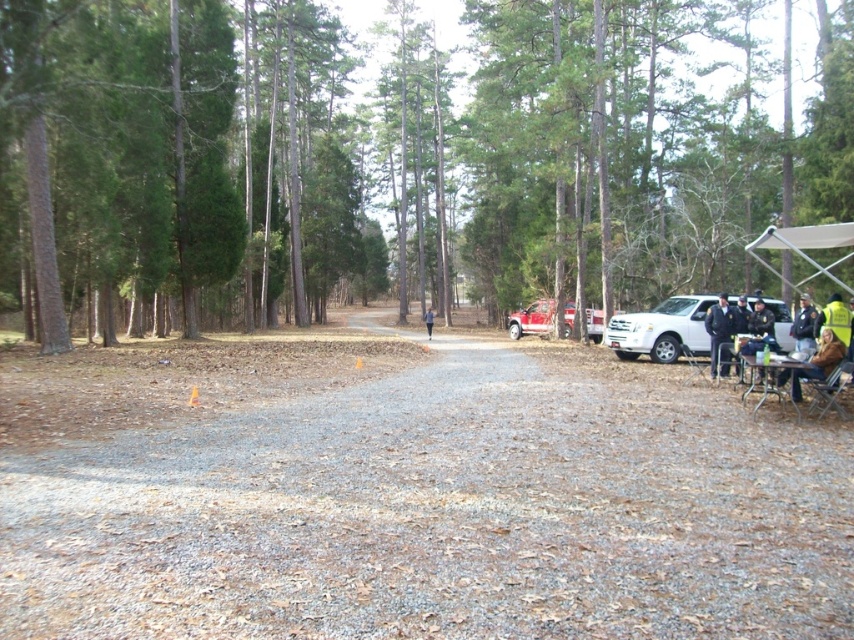
Question: Which point is farther from the camera taking this photo?

Choices:
 (A) (709, 435)
 (B) (829, 385)

Answer: (B)

Question: Which point appears closest to the camera in this image?

Choices:
 (A) (793, 452)
 (B) (586, 316)

Answer: (A)

Question: From the image, what is the correct spatial relationship of wooden picnic table at right in relation to dark blue fabric at center?

Choices:
 (A) right
 (B) left

Answer: (A)

Question: Does brown textured tree at center have a larger size compared to dark blue fabric at center?

Choices:
 (A) yes
 (B) no

Answer: (A)

Question: Is brown textured tree at center to the left of brown fuzzy jacket at lower right from the viewer's perspective?

Choices:
 (A) no
 (B) yes

Answer: (B)

Question: Which object is the farthest from the dark blue uniform at right?

Choices:
 (A) dark blue fabric at center
 (B) brown fuzzy jacket at lower right
 (C) wooden picnic table at right
 (D) white matte suv at right

Answer: (A)